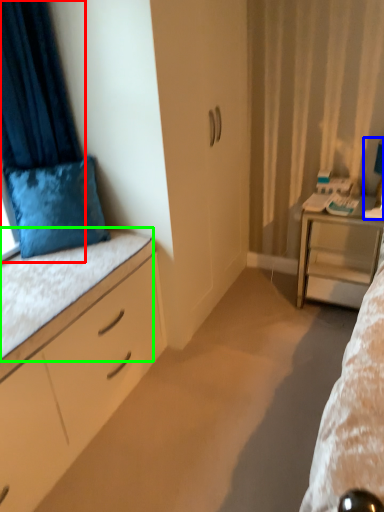
Question: Which object is the farthest from curtain (highlighted by a red box)? Choose among these: table lamp (highlighted by a blue box) or ledge (highlighted by a green box).

Choices:
 (A) table lamp
 (B) ledge

Answer: (A)